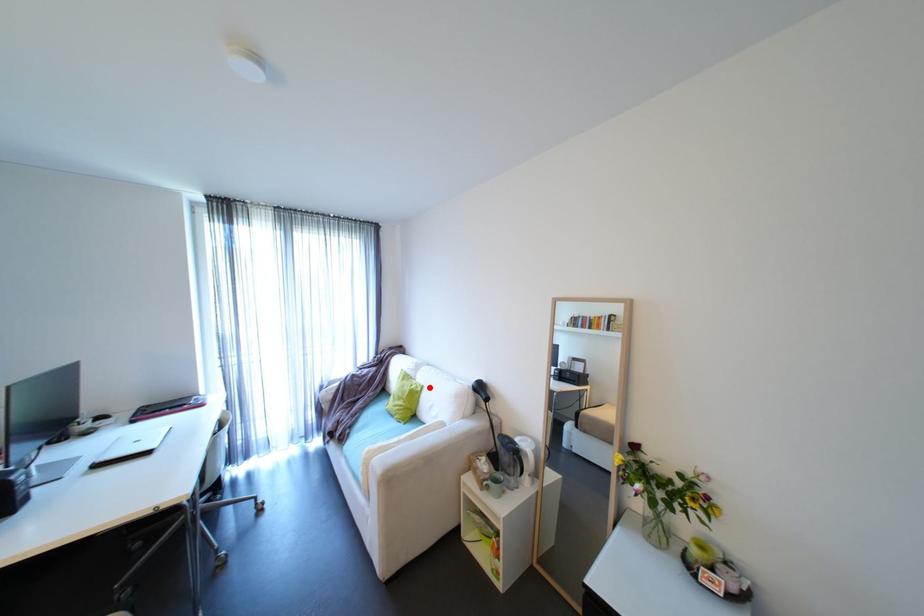
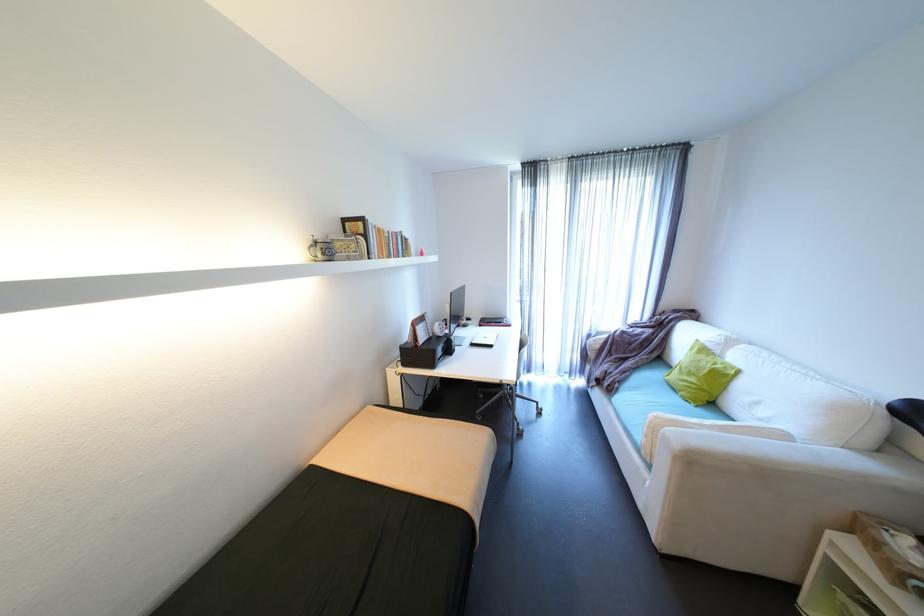
Question: I am providing you with two images of the same scene from different viewpoints. A red point is shown in image1. For the corresponding object point in image2, is it positioned nearer or farther from the camera?

Choices:
 (A) Nearer
 (B) Farther

Answer: (A)